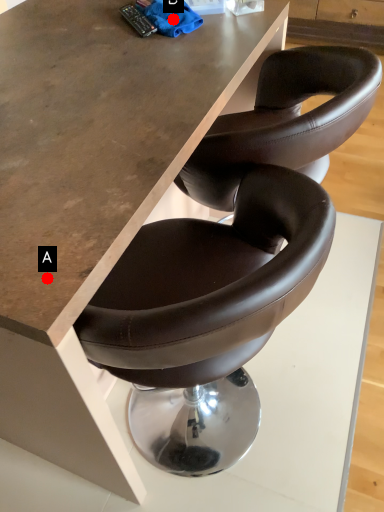
Question: Two points are circled on the image, labeled by A and B beside each circle. Which point is farther to the camera?

Choices:
 (A) A is further
 (B) B is further

Answer: (B)